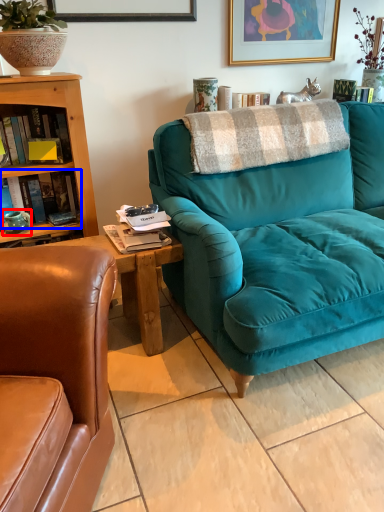
Question: Which point is further to the camera, teal (highlighted by a red box) or book (highlighted by a blue box)?

Choices:
 (A) teal
 (B) book

Answer: (A)